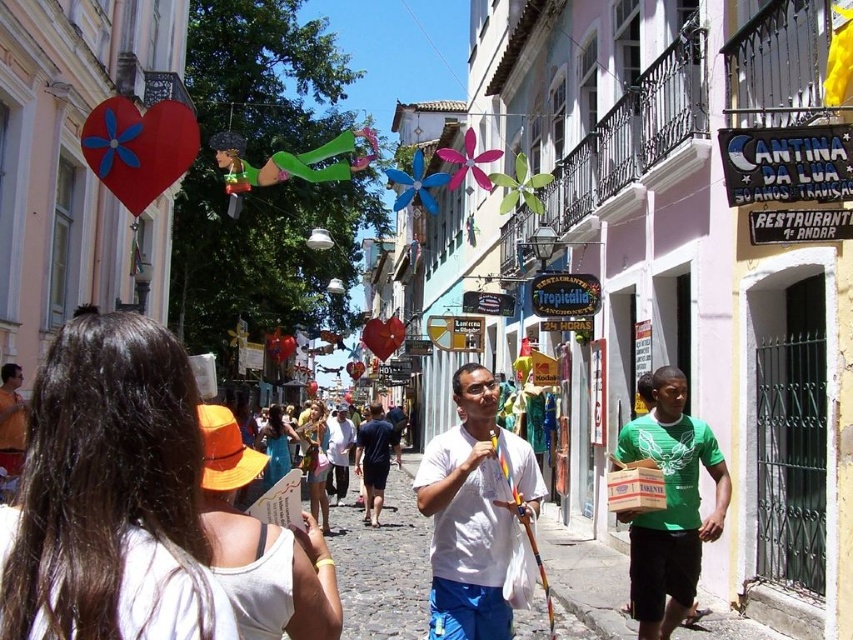
Who is more forward, (252, 544) or (657, 422)?

Point (252, 544) is more forward.

Looking at this image, how distant is orange fabric hat at center from green matte t-shirt at right?

They are 9.05 meters apart.

Which is in front, point (212, 452) or point (654, 589)?

Point (212, 452) is in front.

Where is `orange fabric hat at center`? This screenshot has width=853, height=640. orange fabric hat at center is located at coordinates (262, 547).

What do you see at coordinates (109, 493) in the screenshot?
I see `white fabric at center` at bounding box center [109, 493].

Can you confirm if white fabric at center is positioned below matte white t-shirt at center?

Incorrect, white fabric at center is not positioned below matte white t-shirt at center.

The width and height of the screenshot is (853, 640). I want to click on white fabric at center, so click(109, 493).

Who is higher up, orange fabric hat at center or denim shorts at center?

orange fabric hat at center is higher up.

Does orange fabric hat at center appear on the right side of denim shorts at center?

Indeed, orange fabric hat at center is positioned on the right side of denim shorts at center.

The height and width of the screenshot is (640, 853). Describe the element at coordinates (262, 547) in the screenshot. I see `orange fabric hat at center` at that location.

Find the location of a particular element. The height and width of the screenshot is (640, 853). orange fabric hat at center is located at coordinates (262, 547).